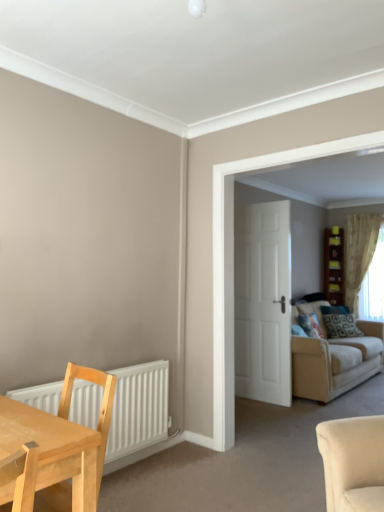
Question: Looking at their shapes, would you say light wood table at lower left is wider or thinner than patterned fabric pillow at center-right?

Choices:
 (A) wide
 (B) thin

Answer: (A)

Question: Does point (84, 440) appear closer or farther from the camera than point (332, 321)?

Choices:
 (A) farther
 (B) closer

Answer: (B)

Question: Estimate the real-world distances between objects in this image. Which object is closer to the white matte door at center?

Choices:
 (A) beige fabric couch at right
 (B) brown wooden bookshelf at center-right
 (C) light wood table at lower left
 (D) sheer beige curtain at right
 (E) white matte radiator at lower left

Answer: (A)

Question: Which of these objects is positioned farthest from the light wood table at lower left?

Choices:
 (A) white matte door at center
 (B) beige fabric couch at right
 (C) patterned fabric pillow at center-right
 (D) brown wooden bookshelf at center-right
 (E) sheer beige curtain at right

Answer: (D)